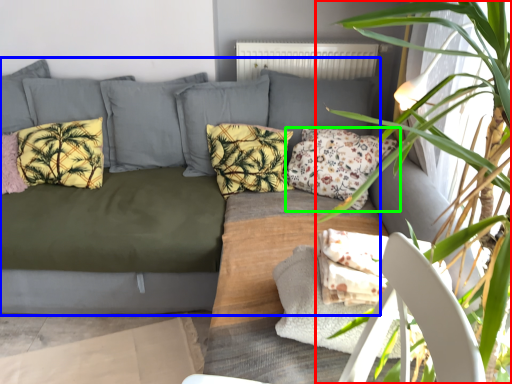
Question: Considering the real-world distances, which object is closest to houseplant (highlighted by a red box)? studio couch (highlighted by a blue box) or pillow (highlighted by a green box).

Choices:
 (A) studio couch
 (B) pillow

Answer: (B)